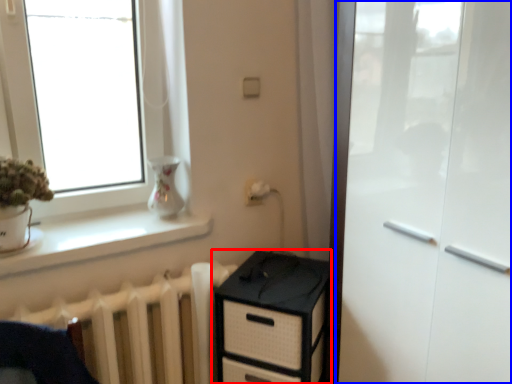
Question: Which object appears farthest to the camera in this image, chest of drawers (highlighted by a red box) or screen door (highlighted by a blue box)?

Choices:
 (A) chest of drawers
 (B) screen door

Answer: (A)